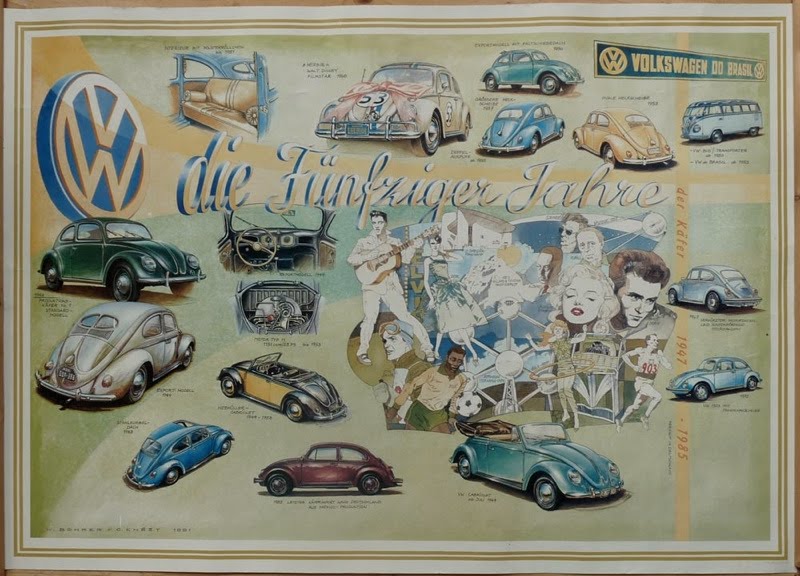
Find the location of a particular element. The width and height of the screenshot is (800, 576). seat is located at coordinates (226, 104).